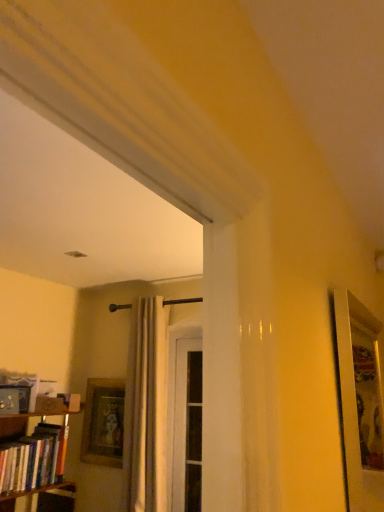
Question: Is hardcover books at left outside of white sheer curtain at center?

Choices:
 (A) no
 (B) yes

Answer: (B)

Question: Does hardcover books at left appear on the right side of white sheer curtain at center?

Choices:
 (A) no
 (B) yes

Answer: (A)

Question: Is hardcover books at left smaller than white sheer curtain at center?

Choices:
 (A) no
 (B) yes

Answer: (B)

Question: Does hardcover books at left come behind white sheer curtain at center?

Choices:
 (A) no
 (B) yes

Answer: (A)

Question: Could you tell me if hardcover books at left is turned towards white sheer curtain at center?

Choices:
 (A) no
 (B) yes

Answer: (A)

Question: Does point (183, 425) appear closer or farther from the camera than point (13, 451)?

Choices:
 (A) closer
 (B) farther

Answer: (B)

Question: In the image, is white wood screen door at center positioned in front of or behind hardcover books at left?

Choices:
 (A) front
 (B) behind

Answer: (B)

Question: Is white wood screen door at center bigger or smaller than hardcover books at left?

Choices:
 (A) small
 (B) big

Answer: (A)

Question: Visually, is white wood screen door at center positioned to the left or to the right of hardcover books at left?

Choices:
 (A) left
 (B) right

Answer: (B)

Question: Based on their positions, is white sheer curtain at center located to the left or right of wooden picture frame at lower left?

Choices:
 (A) left
 (B) right

Answer: (B)

Question: Is point (162, 312) closer or farther from the camera than point (87, 435)?

Choices:
 (A) farther
 (B) closer

Answer: (B)

Question: Considering the positions of white sheer curtain at center and wooden picture frame at lower left in the image, is white sheer curtain at center taller or shorter than wooden picture frame at lower left?

Choices:
 (A) short
 (B) tall

Answer: (B)

Question: Is white sheer curtain at center inside the boundaries of wooden picture frame at lower left, or outside?

Choices:
 (A) outside
 (B) inside

Answer: (A)

Question: Is hardcover books at left wider or thinner than wooden picture frame at lower left?

Choices:
 (A) thin
 (B) wide

Answer: (B)

Question: In the image, is hardcover books at left positioned in front of or behind wooden picture frame at lower left?

Choices:
 (A) behind
 (B) front

Answer: (B)